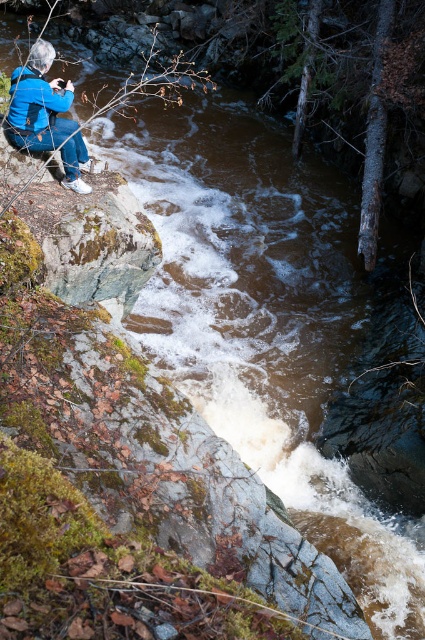
Question: Among these objects, which one is farthest from the camera?

Choices:
 (A) blue matte jacket at upper left
 (B) blue fabric jacket at upper left

Answer: (A)

Question: Among these objects, which one is nearest to the camera?

Choices:
 (A) blue fabric jacket at upper left
 (B) blue matte jacket at upper left

Answer: (A)

Question: Does blue fabric jacket at upper left have a larger size compared to blue matte jacket at upper left?

Choices:
 (A) yes
 (B) no

Answer: (A)

Question: Among these points, which one is nearest to the camera?

Choices:
 (A) (39, 96)
 (B) (11, 93)

Answer: (A)

Question: In this image, where is blue fabric jacket at upper left located relative to blue matte jacket at upper left?

Choices:
 (A) left
 (B) right

Answer: (B)

Question: Does blue fabric jacket at upper left appear on the right side of blue matte jacket at upper left?

Choices:
 (A) no
 (B) yes

Answer: (B)